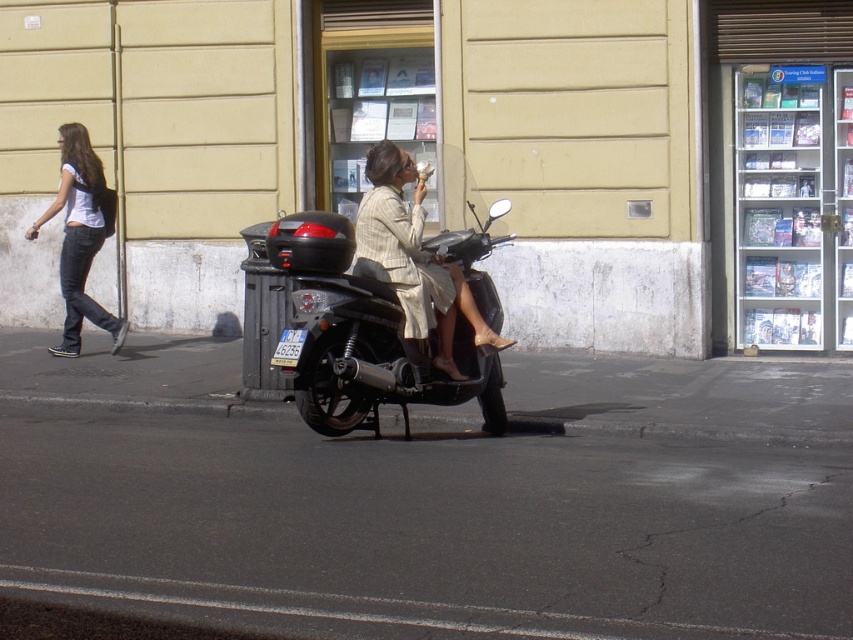
Consider the image. Which of these two, shiny black scooter at center or denim jeans at left, stands taller?

Standing taller between the two is denim jeans at left.

Can you confirm if shiny black scooter at center is taller than denim jeans at left?

No.

Describe the element at coordinates (363, 339) in the screenshot. I see `shiny black scooter at center` at that location.

Image resolution: width=853 pixels, height=640 pixels. What are the coordinates of `shiny black scooter at center` in the screenshot? It's located at (363, 339).

Based on the photo, can you confirm if matte beige dress at center is smaller than denim jeans at left?

Yes.

Is point (479, 314) farther from camera compared to point (84, 276)?

No.

I want to click on matte beige dress at center, so click(413, 259).

Does shiny black scooter at center have a larger size compared to matte beige dress at center?

Yes.

Does point (439, 378) come in front of point (405, 328)?

No, (439, 378) is further to viewer.

I want to click on shiny black scooter at center, so click(x=363, y=339).